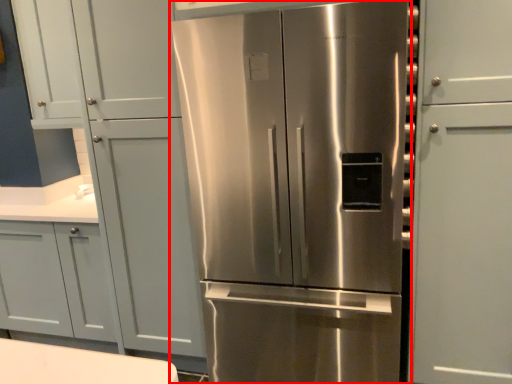
Question: From the image's perspective, considering the relative positions of refrigerator (annotated by the red box) and door in the image provided, where is refrigerator (annotated by the red box) located with respect to the staircase?

Choices:
 (A) above
 (B) below

Answer: (B)